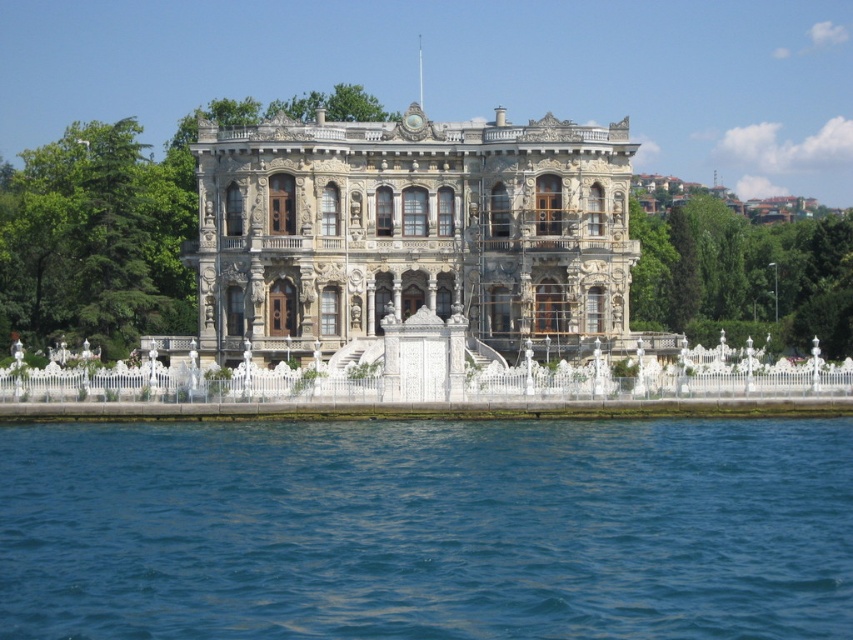
You are standing on the white stone palace at center and want to reach the blue liquid water at lower center. Which direction should you move to get there?

You should move to the right to reach the blue liquid water at lower center since it is located to the right of the white stone palace at center.